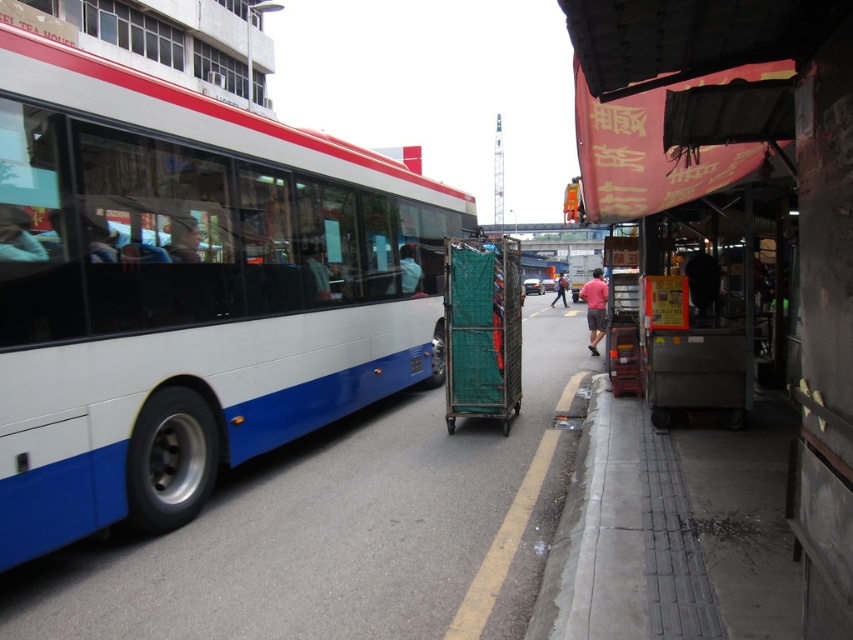
You are a delivery person who needs to move a package from the metallic cart at right to the pink fabric at center. Given that the distance between them is 105.55 feet, can you estimate how many steps you would need to take if each step covers about 2.5 feet?

The distance between the metallic cart at right and the pink fabric at center is 105.55 feet. Dividing this by 2.5 feet per step gives approximately 42.22 steps. Since you can only take whole steps, you would need around 42 steps to cover the distance between the metallic cart at right and the pink fabric at center.

You are a pedestrian standing at the camera position. You see a green mesh cart at center. Can you safely step onto the road to pick up an item from the cart without moving closer than 5 meters?

The green mesh cart at center is 7.33 meters away from you. Since 7.33 meters is greater than 5 meters, you can safely step onto the road to pick up an item from the cart without moving closer than 5 meters.